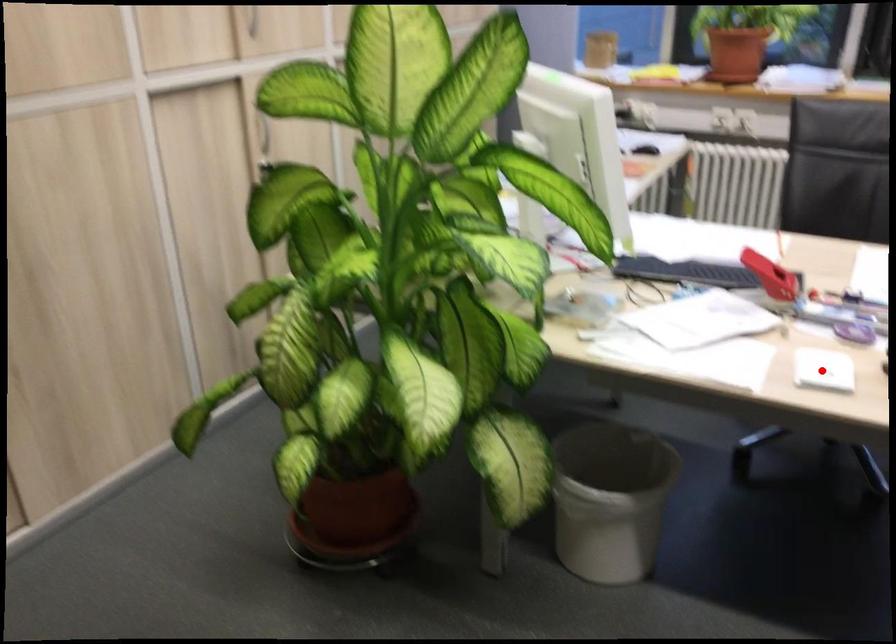
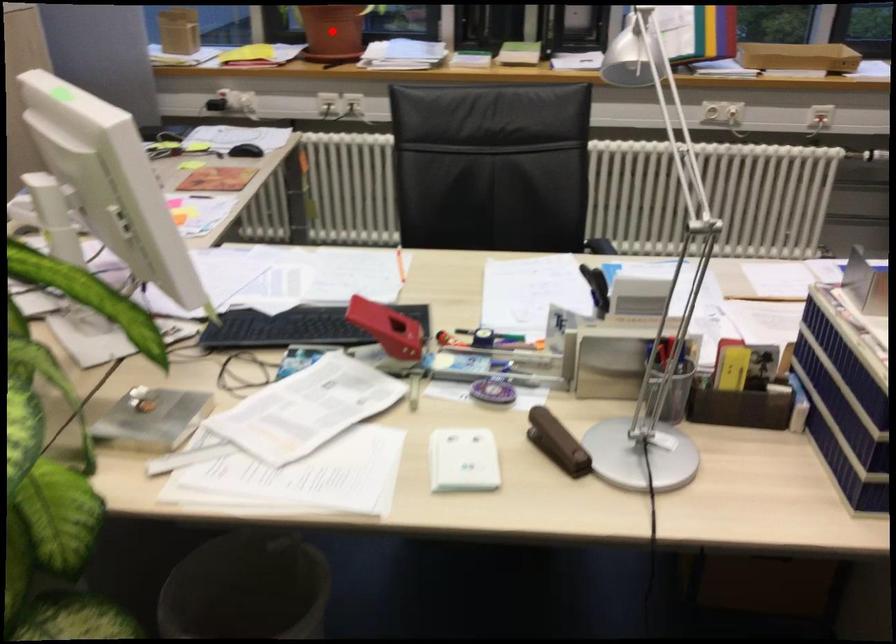
I am providing you with two images of the same scene from different viewpoints. A red point is marked on the first image and another point is marked on the second image. Do the highlighted points in image1 and image2 indicate the same real-world spot?

No